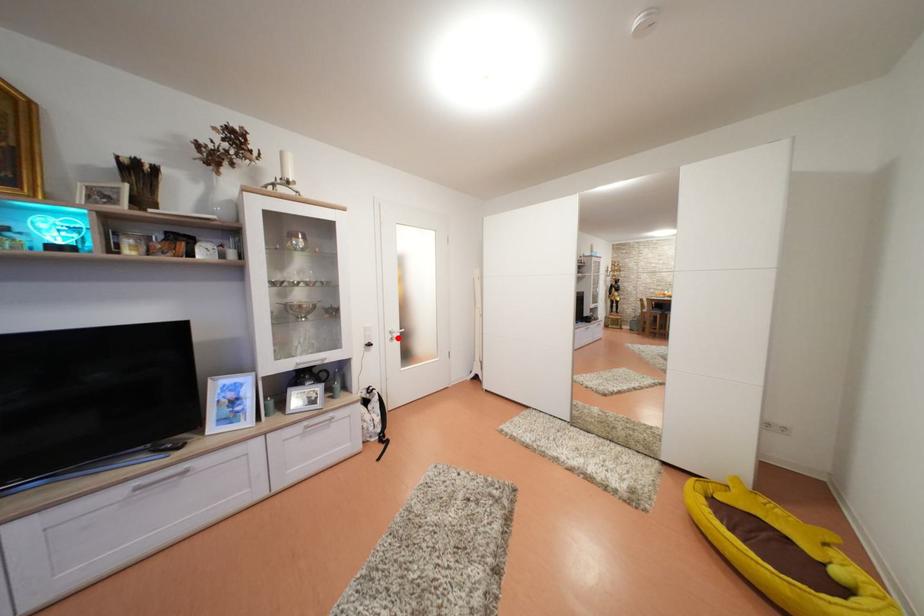
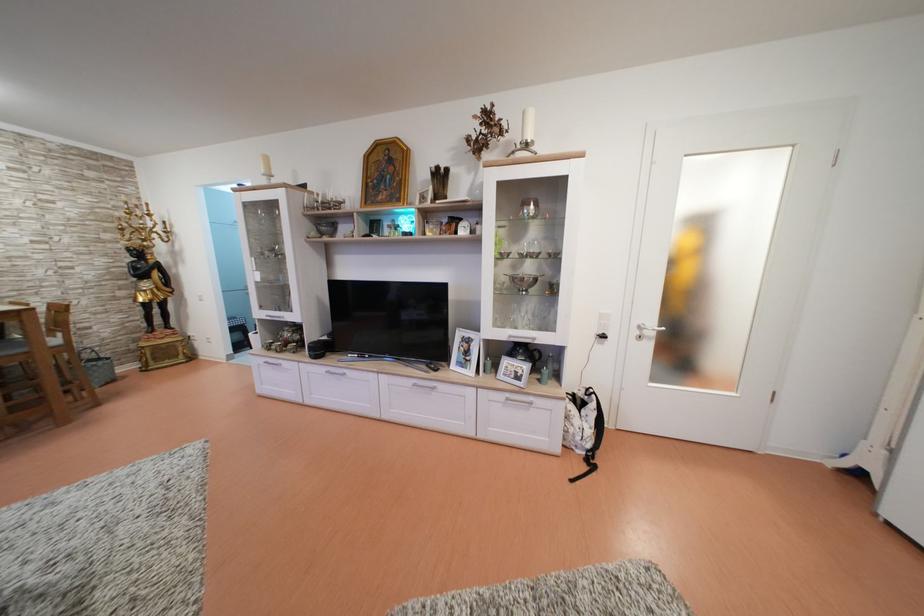
Question: I am providing you with two images of the same scene from different viewpoints. Image1 has a red point marked. In image2, the corresponding 3D location appears at what relative position? Reply with the corresponding letter.

Choices:
 (A) Closer
 (B) Farther

Answer: (A)